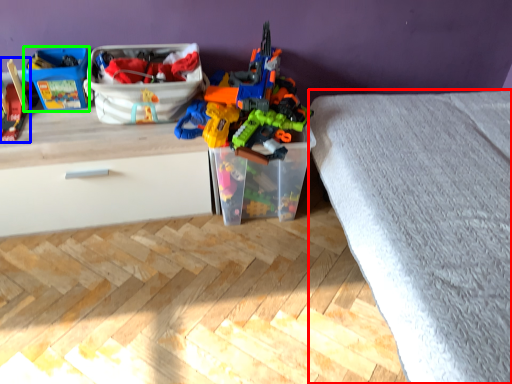
Question: Considering the real-world distances, which object is farthest from bed frame (highlighted by a red box)? toy (highlighted by a blue box) or storage box (highlighted by a green box)?

Choices:
 (A) toy
 (B) storage box

Answer: (A)